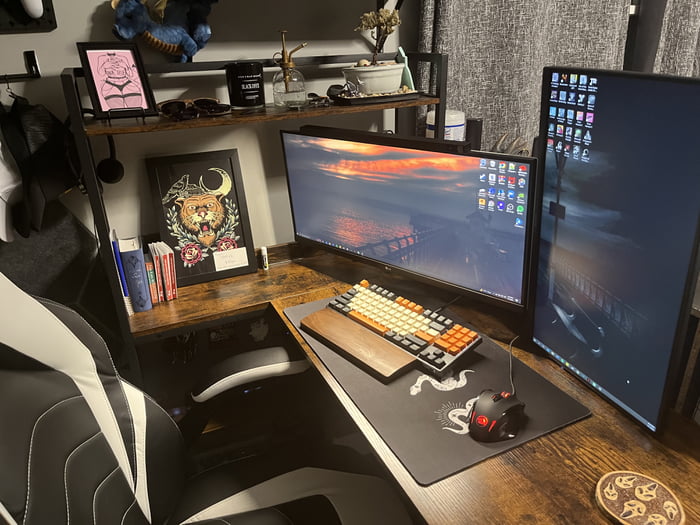
This screenshot has height=525, width=700. I want to click on desk, so click(536, 467).